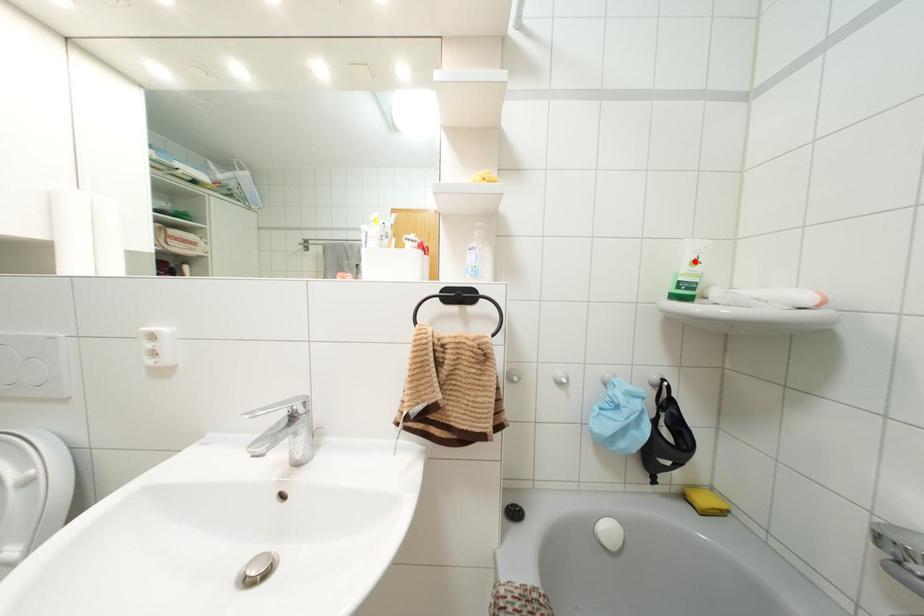
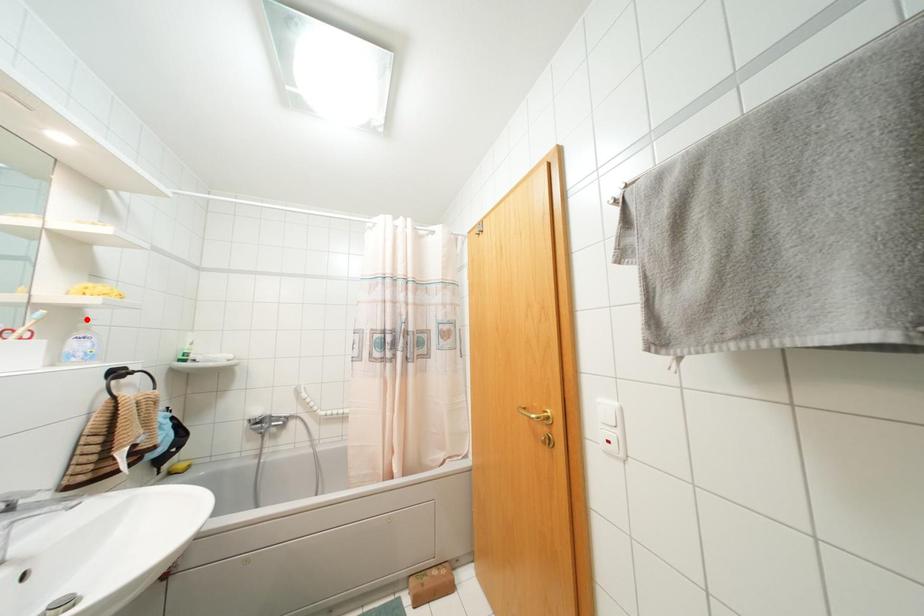
I am providing you with two images of the same scene from different viewpoints. A red point is marked on the first image and another point is marked on the second image. Is the marked point in image1 the same physical position as the marked point in image2?

No